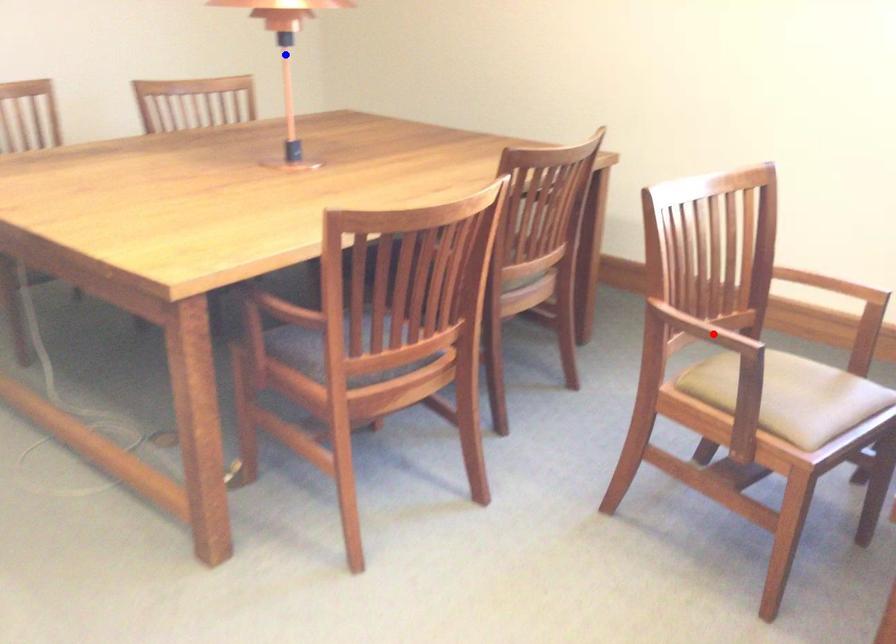
Question: Two points are marked on the image. Which point is closer to the camera?

Choices:
 (A) Blue point is closer.
 (B) Red point is closer.

Answer: (B)